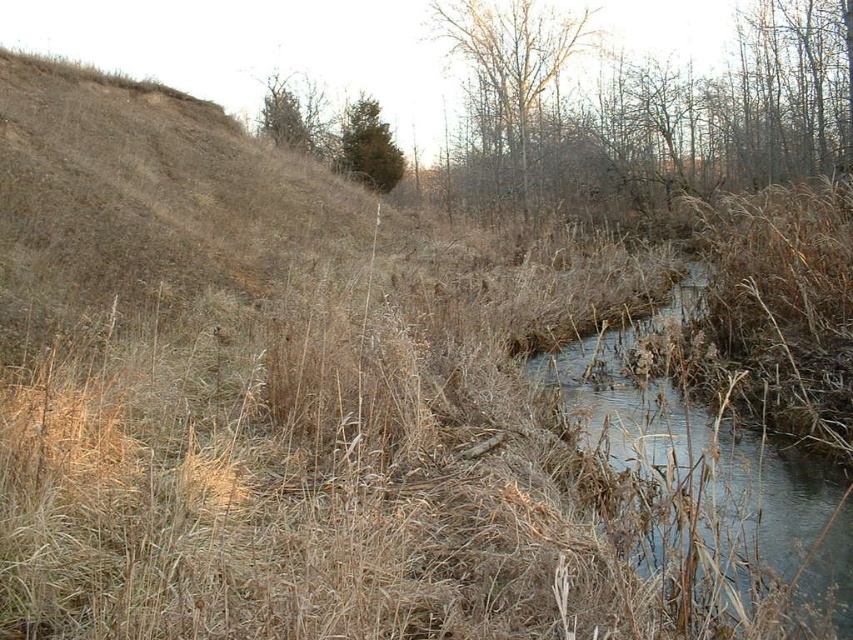
Consider the image. How much distance is there between bare branches at upper center and brown leafless tree at upper center?

They are 8.61 feet apart.

Can you confirm if bare branches at upper center is shorter than brown leafless tree at upper center?

Yes, bare branches at upper center is shorter than brown leafless tree at upper center.

Is point (618, 68) positioned behind point (584, 38)?

Yes, it is.

At what (x,y) coordinates should I click in order to perform the action: click on bare branches at upper center. Please return your answer as a coordinate pair (x, y). The width and height of the screenshot is (853, 640). Looking at the image, I should click on (646, 109).

Is bare branches at upper center behind clear water at center?

Yes, it is.

Is bare branches at upper center wider than clear water at center?

Yes, bare branches at upper center is wider than clear water at center.

Identify the location of bare branches at upper center. Image resolution: width=853 pixels, height=640 pixels. (646, 109).

Locate an element on the screen. The image size is (853, 640). bare branches at upper center is located at coordinates (646, 109).

Does brown leafless tree at upper center have a lesser width compared to green matte tree at upper center?

No, brown leafless tree at upper center is not thinner than green matte tree at upper center.

Is brown leafless tree at upper center to the left of green matte tree at upper center from the viewer's perspective?

No, brown leafless tree at upper center is not to the left of green matte tree at upper center.

The image size is (853, 640). Identify the location of brown leafless tree at upper center. (509, 68).